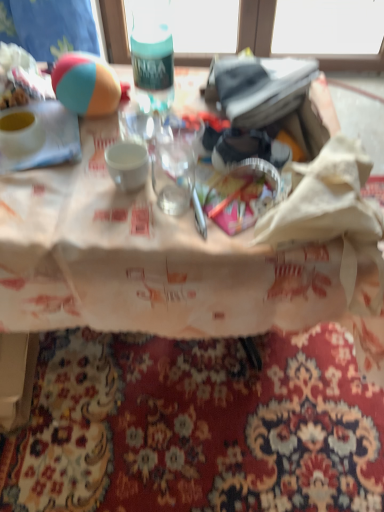
Locate an element on the screen. vacant area that is situated to the right of tri-color rubber ball at upper left is located at coordinates (170, 117).